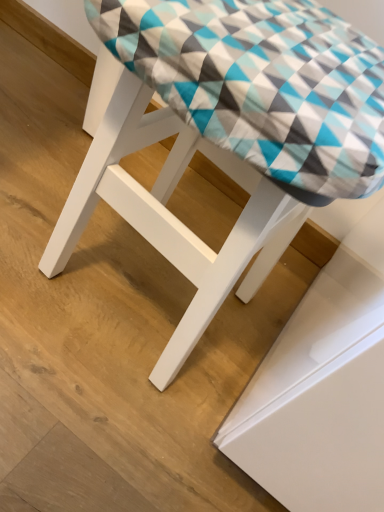
The width and height of the screenshot is (384, 512). In order to click on white matte stool at center in this screenshot , I will do `click(166, 209)`.

Describe the element at coordinates (166, 209) in the screenshot. I see `white matte stool at center` at that location.

Find the location of `white matte stool at center`. white matte stool at center is located at coordinates (166, 209).